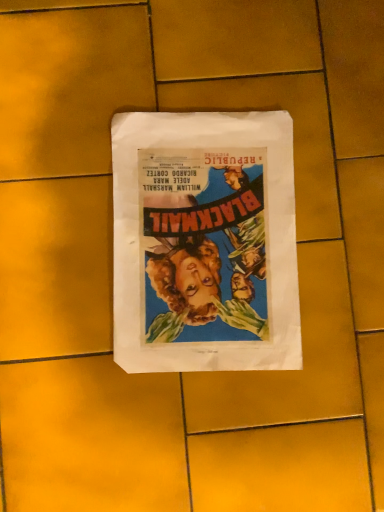
Describe the element at coordinates (204, 242) in the screenshot. This screenshot has width=384, height=512. I see `matte paper poster at center` at that location.

You are a GUI agent. You are given a task and a screenshot of the screen. Output one action in this format:
    pyautogui.click(x=<x>, y=<y>)
    Task: Click on the matte paper poster at center
    This screenshot has width=384, height=512.
    Given the screenshot: What is the action you would take?
    pyautogui.click(x=204, y=242)

The width and height of the screenshot is (384, 512). In order to click on matte paper poster at center in this screenshot , I will do (204, 242).